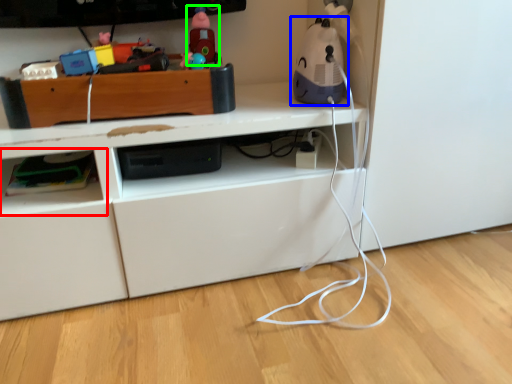
Question: Estimate the real-world distances between objects in this image. Which object is farther from shelf (highlighted by a red box), toy (highlighted by a blue box) or toy (highlighted by a green box)?

Choices:
 (A) toy
 (B) toy

Answer: (A)